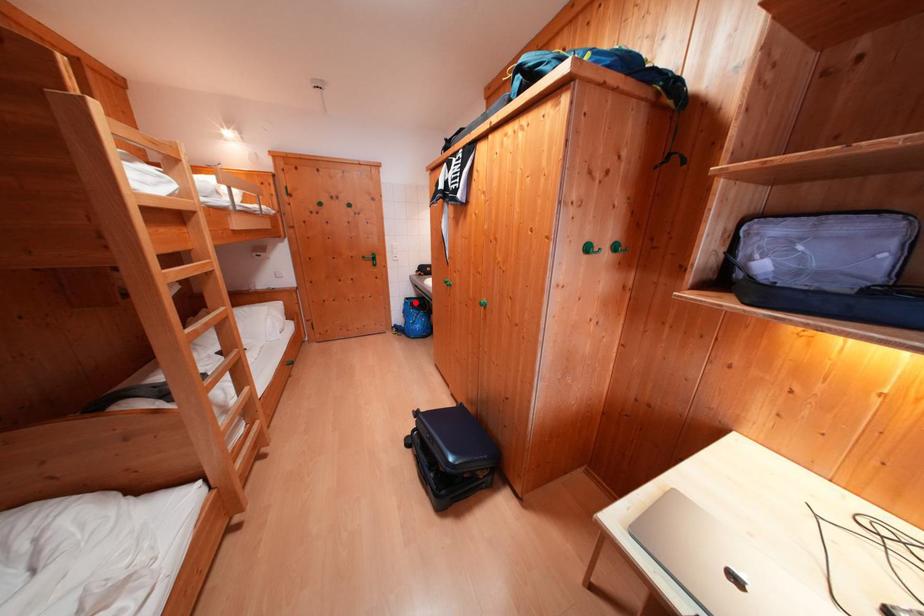
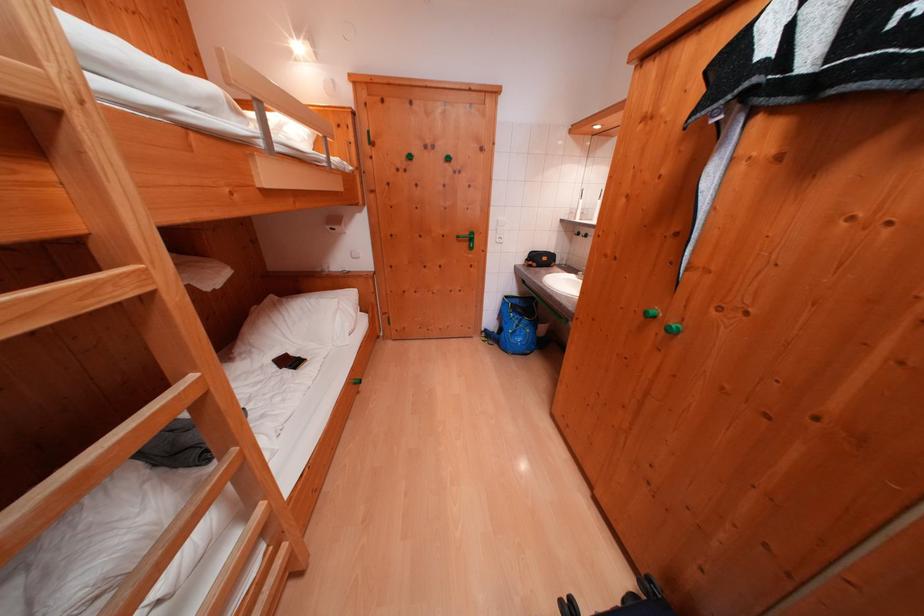
Where in the second image is the point corresponding to the highlighted location from the first image?

(515, 301)